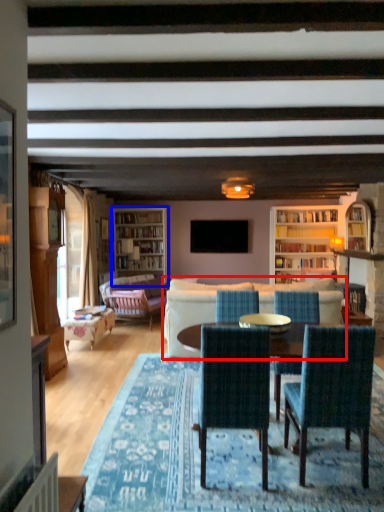
Question: Which object appears farthest to the camera in this image, studio couch (highlighted by a red box) or bookcase (highlighted by a blue box)?

Choices:
 (A) studio couch
 (B) bookcase

Answer: (B)